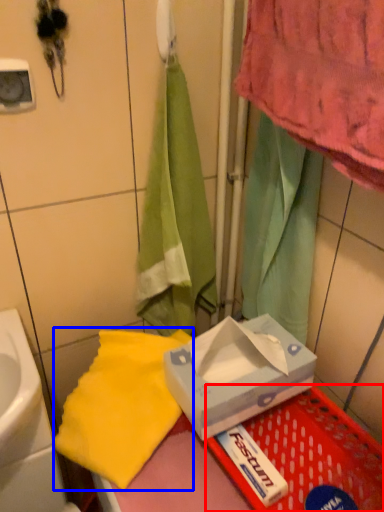
Question: Which object appears farthest to the camera in this image, basket (highlighted by a red box) or beach towel (highlighted by a blue box)?

Choices:
 (A) basket
 (B) beach towel

Answer: (B)